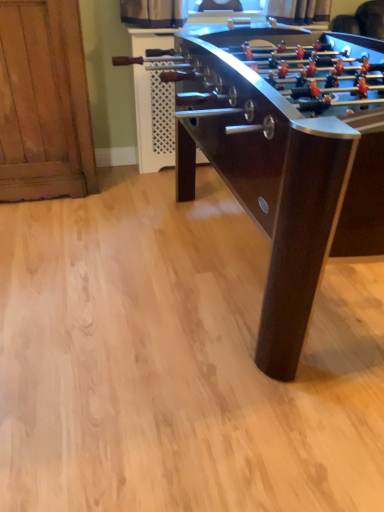
Question: Is dark brown wood foosball table at center at the back of wooden cabinet at left?

Choices:
 (A) no
 (B) yes

Answer: (A)

Question: Is wooden cabinet at left thinner than dark brown wood foosball table at center?

Choices:
 (A) no
 (B) yes

Answer: (B)

Question: Can you confirm if wooden cabinet at left is shorter than dark brown wood foosball table at center?

Choices:
 (A) yes
 (B) no

Answer: (B)

Question: Can you confirm if wooden cabinet at left is smaller than dark brown wood foosball table at center?

Choices:
 (A) yes
 (B) no

Answer: (A)

Question: Does wooden cabinet at left appear on the left side of dark brown wood foosball table at center?

Choices:
 (A) yes
 (B) no

Answer: (A)

Question: From the image's perspective, would you say wooden cabinet at left is shown under dark brown wood foosball table at center?

Choices:
 (A) yes
 (B) no

Answer: (B)

Question: Is dark brown wood foosball table at center not within wooden cabinet at left?

Choices:
 (A) no
 (B) yes

Answer: (B)

Question: Is the depth of dark brown wood foosball table at center greater than that of wooden cabinet at left?

Choices:
 (A) no
 (B) yes

Answer: (A)

Question: Is dark brown wood foosball table at center thinner than wooden cabinet at left?

Choices:
 (A) yes
 (B) no

Answer: (B)

Question: Can you confirm if dark brown wood foosball table at center is positioned to the right of wooden cabinet at left?

Choices:
 (A) yes
 (B) no

Answer: (A)

Question: From the image's perspective, is dark brown wood foosball table at center beneath wooden cabinet at left?

Choices:
 (A) no
 (B) yes

Answer: (B)

Question: From a real-world perspective, is dark brown wood foosball table at center below wooden cabinet at left?

Choices:
 (A) yes
 (B) no

Answer: (A)

Question: Is wooden cabinet at left wider or thinner than dark brown wood foosball table at center?

Choices:
 (A) wide
 (B) thin

Answer: (B)